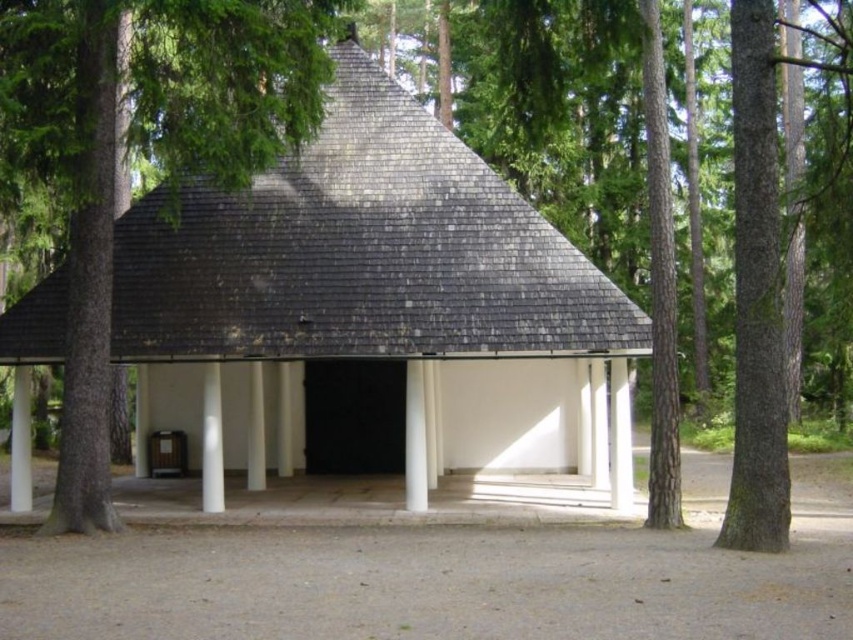
Question: Which point is farther to the camera?

Choices:
 (A) (378, 358)
 (B) (743, 429)

Answer: (A)

Question: Can you confirm if wooden shingles hut at center is thinner than brown rough bark tree at right?

Choices:
 (A) yes
 (B) no

Answer: (B)

Question: Which point is closer to the camera?

Choices:
 (A) wooden shingles hut at center
 (B) brown rough bark tree at right

Answer: (B)

Question: Does wooden shingles hut at center have a larger size compared to brown rough bark tree at right?

Choices:
 (A) no
 (B) yes

Answer: (A)

Question: Among these objects, which one is nearest to the camera?

Choices:
 (A) brown rough bark tree at right
 (B) wooden shingles hut at center

Answer: (A)

Question: Does wooden shingles hut at center appear on the right side of brown rough bark tree at right?

Choices:
 (A) no
 (B) yes

Answer: (A)